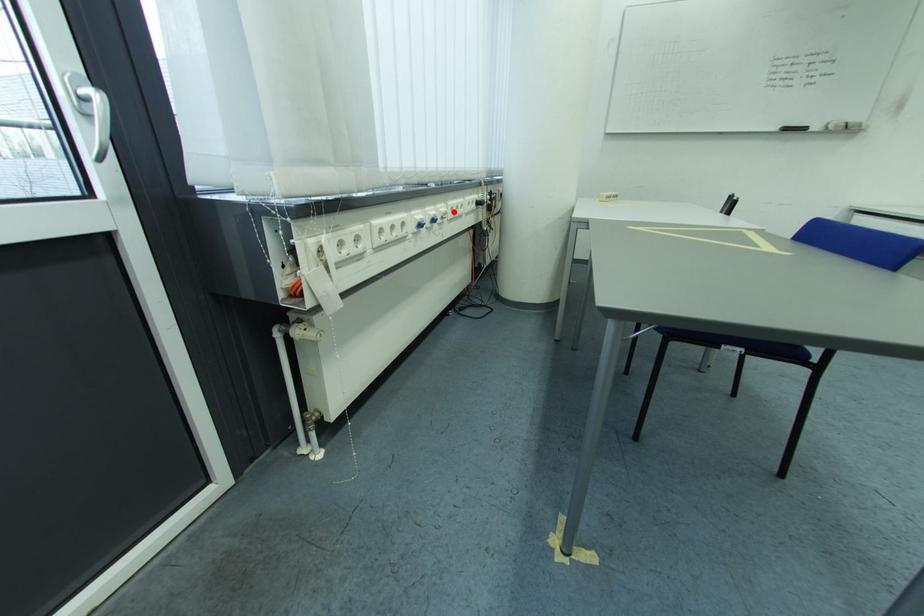
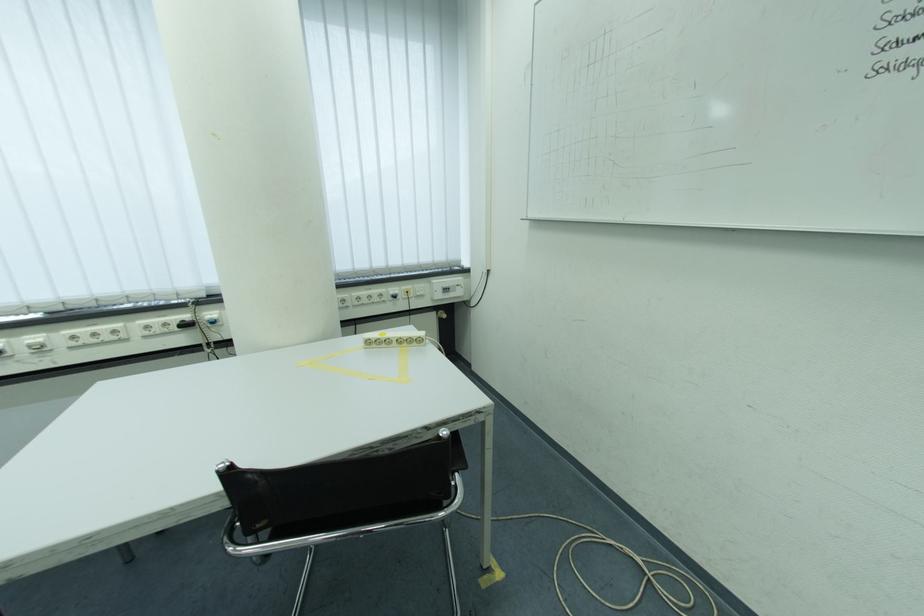
Question: A red point is marked in image1. In image2, is the corresponding 3D point closer to the camera or farther? Reply with the corresponding letter.

Choices:
 (A) The corresponding 3D point is closer.
 (B) The corresponding 3D point is farther.

Answer: (B)